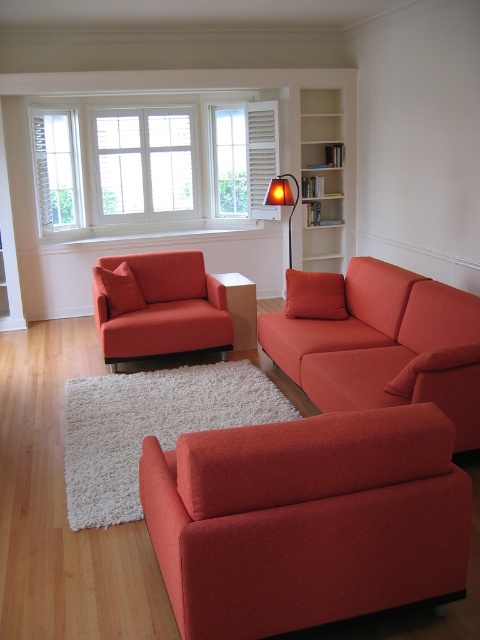
You are a guest entering the living room and want to sit down. Which object between the matte orange armchair at lower center and the orange fabric lamp at center is more suitable for sitting?

The matte orange armchair at lower center is suitable for sitting because it is shorter than the orange fabric lamp at center, which is likely a standing lamp and not meant for sitting.

You are standing in the living room and want to place a small plant on the floor next to the matte orange armchair at lower center. Can you place it directly under the orange fabric lamp at center?

The matte orange armchair at lower center is below the orange fabric lamp at center, so placing the plant directly under the lamp would also place it next to the armchair.